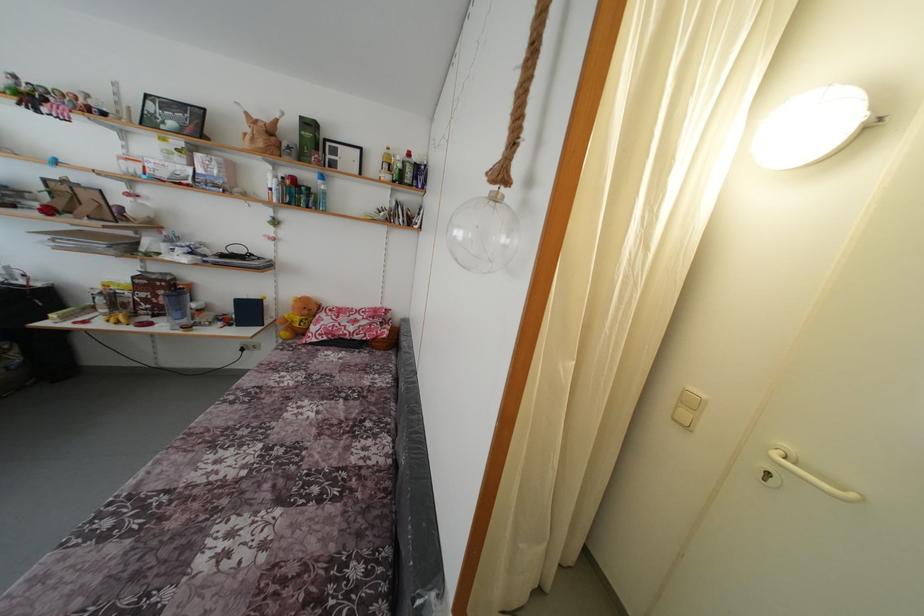
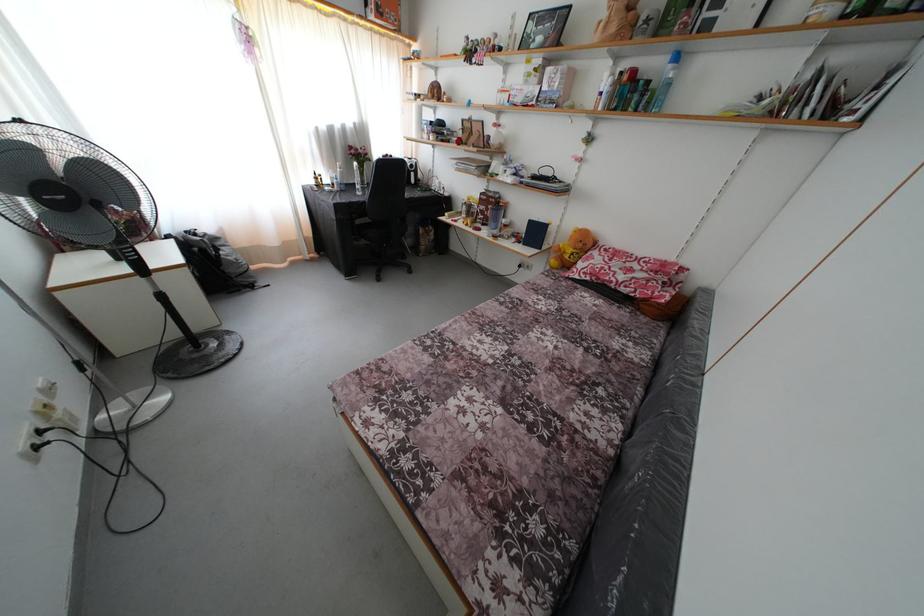
Locate, in the second image, the point that corresponds to pixel 324 188 in the first image.

(675, 73)